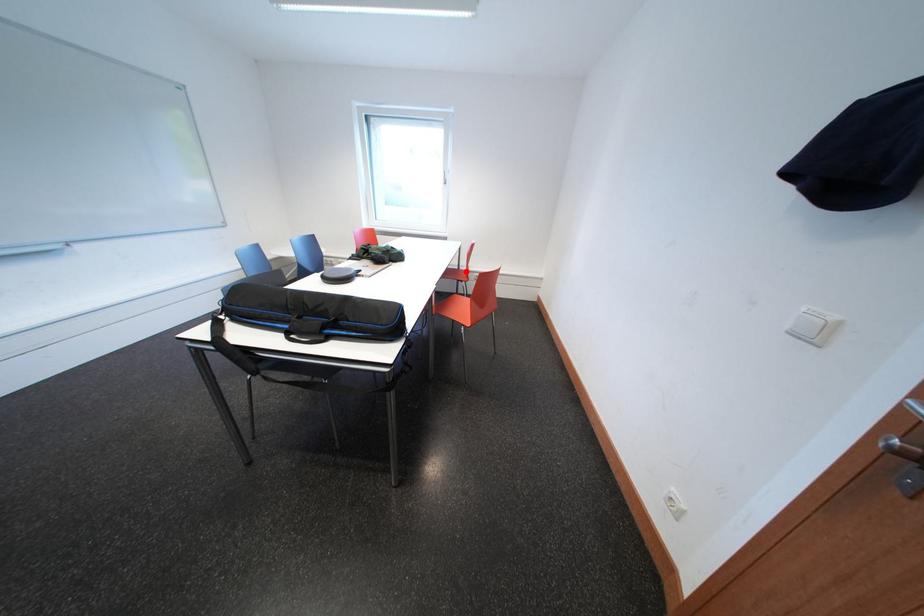
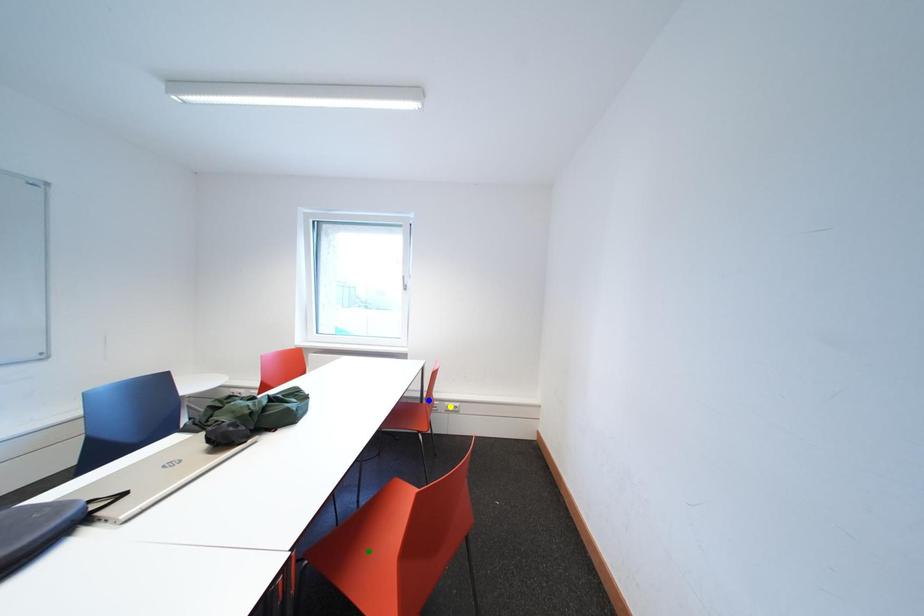
Question: I am providing you with two images of the same scene from different viewpoints. A red point is marked on the first image. You are given multiple points on the second image. Which point in image 2 is actually the same real-world point as the red point in image 1?

Choices:
 (A) green point
 (B) blue point
 (C) yellow point

Answer: (B)